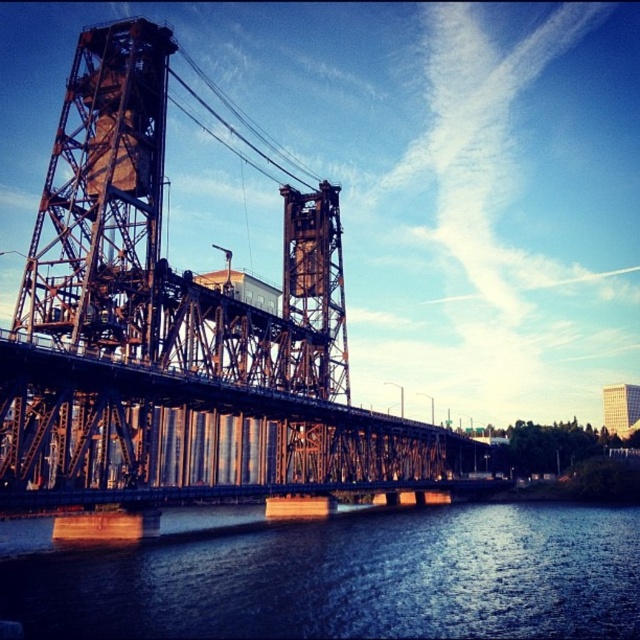
Question: Which point is farther from the camera taking this photo?

Choices:
 (A) (202, 320)
 (B) (132, 177)
 (C) (618, 396)

Answer: (C)

Question: Which object is farther from the camera taking this photo?

Choices:
 (A) rusty metal bridge tower at center
 (B) white glass building at upper right

Answer: (B)

Question: Among these objects, which one is nearest to the camera?

Choices:
 (A) black steel bridge at center
 (B) white glass building at upper right

Answer: (A)

Question: Observing the image, what is the correct spatial positioning of black steel bridge at center in reference to metallic wire at upper center?

Choices:
 (A) above
 (B) below

Answer: (B)

Question: Is metallic wire at upper center thinner than white glass building at upper right?

Choices:
 (A) no
 (B) yes

Answer: (A)

Question: Is metallic wire at upper center behind white glass building at upper right?

Choices:
 (A) no
 (B) yes

Answer: (A)